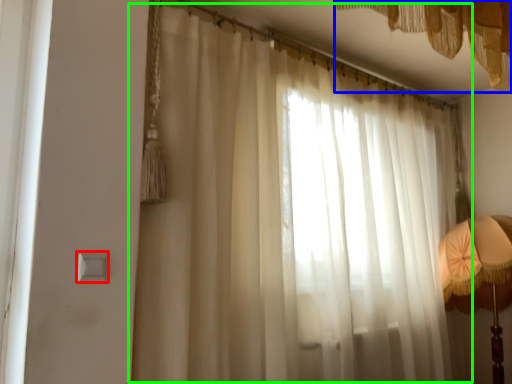
Question: Considering the real-world distances, which object is closest to light switch (highlighted by a red box)? curtain (highlighted by a blue box) or curtain (highlighted by a green box).

Choices:
 (A) curtain
 (B) curtain

Answer: (B)